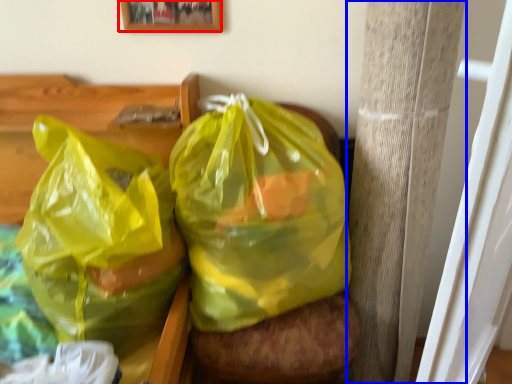
Question: Which point is further to the camera, picture frame (highlighted by a red box) or pillar (highlighted by a blue box)?

Choices:
 (A) picture frame
 (B) pillar

Answer: (A)